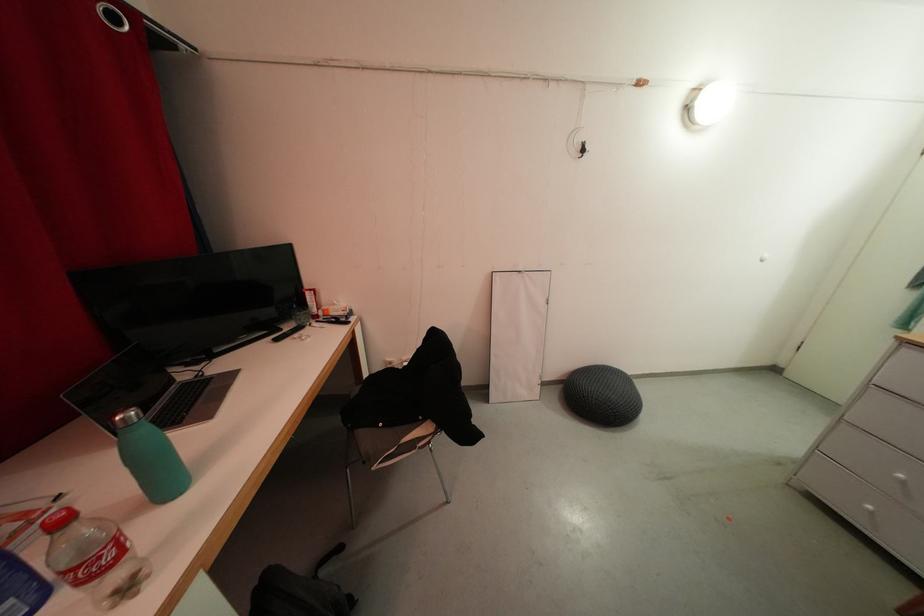
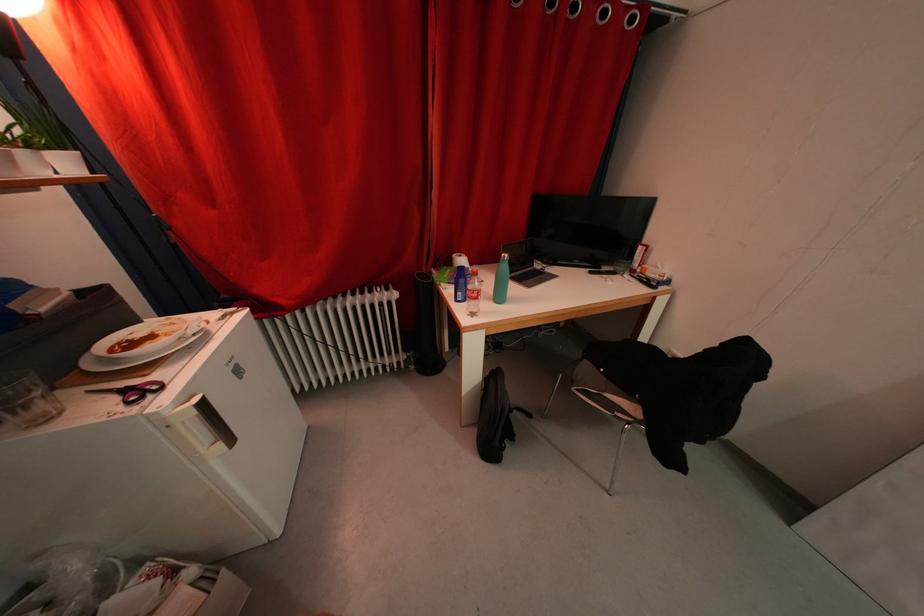
Locate, in the second image, the point that corresponds to (173,487) in the first image.

(505, 301)